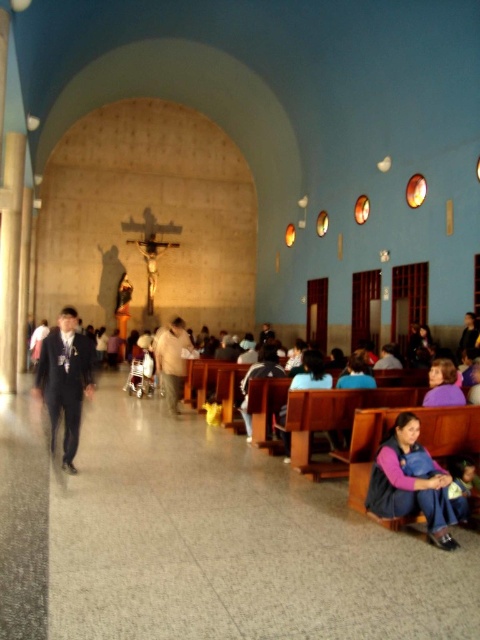
Question: Does denim vest at lower right appear over light brown leather jacket at center?

Choices:
 (A) yes
 (B) no

Answer: (B)

Question: In this image, where is denim vest at lower right located relative to purple fabric at lower right?

Choices:
 (A) left
 (B) right

Answer: (A)

Question: Which of the following is the closest to the observer?

Choices:
 (A) (430, 532)
 (B) (173, 323)
 (C) (436, 404)
 (D) (57, 365)

Answer: (A)

Question: Is matte black suit at center bigger than purple fabric at lower right?

Choices:
 (A) yes
 (B) no

Answer: (A)

Question: Which object is farther from the camera taking this photo?

Choices:
 (A) light brown leather jacket at center
 (B) purple fabric at lower right

Answer: (A)

Question: Which of the following is the farthest from the observer?

Choices:
 (A) denim vest at lower right
 (B) matte black suit at center
 (C) purple fabric at lower right

Answer: (B)